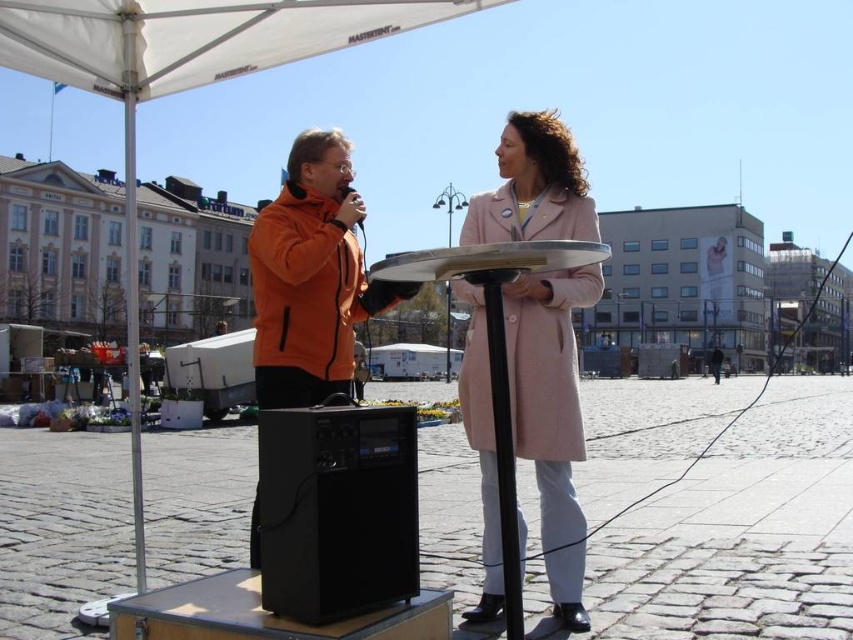
Can you confirm if pink wool coat at center is wider than black plastic speaker at center?

Yes.

Which is more to the right, pink wool coat at center or black plastic speaker at center?

pink wool coat at center is more to the right.

Which is in front, point (572, 292) or point (274, 588)?

Point (274, 588) is more forward.

Locate an element on the screen. The width and height of the screenshot is (853, 640). pink wool coat at center is located at coordinates (550, 417).

Can you confirm if pink wool coat at center is thinner than matte black microphone at center?

In fact, pink wool coat at center might be wider than matte black microphone at center.

Can you confirm if pink wool coat at center is bigger than matte black microphone at center?

Correct, pink wool coat at center is larger in size than matte black microphone at center.

What do you see at coordinates (550, 417) in the screenshot? I see `pink wool coat at center` at bounding box center [550, 417].

This screenshot has height=640, width=853. I want to click on pink wool coat at center, so click(x=550, y=417).

Who is more distant from viewer, (479,316) or (265,307)?

The point (265,307) is behind.

Does pink wool coat at center have a lesser width compared to orange fleece jacket at left?

Indeed, pink wool coat at center has a lesser width compared to orange fleece jacket at left.

Find the location of a particular element. The width and height of the screenshot is (853, 640). pink wool coat at center is located at coordinates (550, 417).